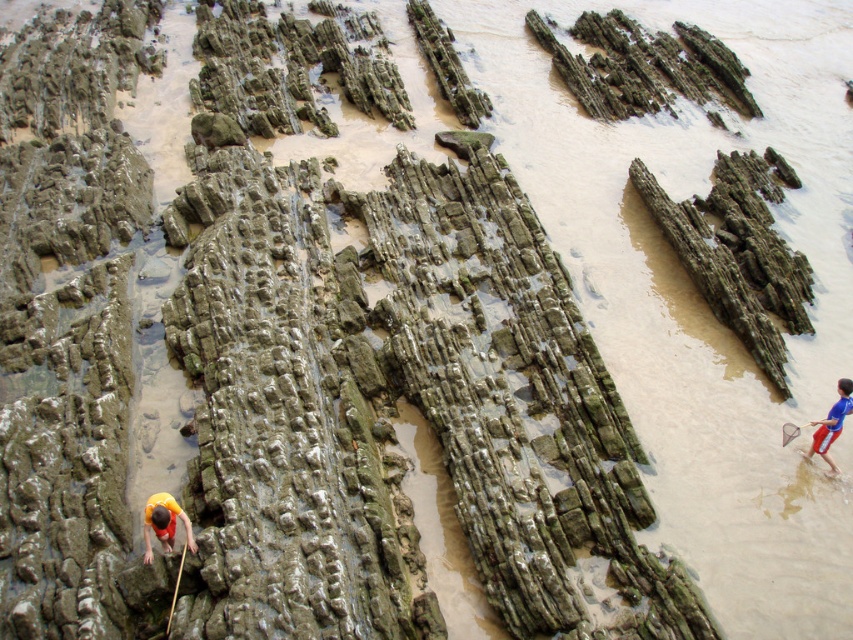
Is yellow fabric at lower left to the right of blue jersey at lower right from the viewer's perspective?

Incorrect, yellow fabric at lower left is not on the right side of blue jersey at lower right.

Which is behind, point (148, 512) or point (824, 424)?

The point (824, 424) is more distant.

Does point (151, 520) lie behind point (813, 438)?

No.

Where is `yellow fabric at lower left`? The image size is (853, 640). yellow fabric at lower left is located at coordinates (164, 524).